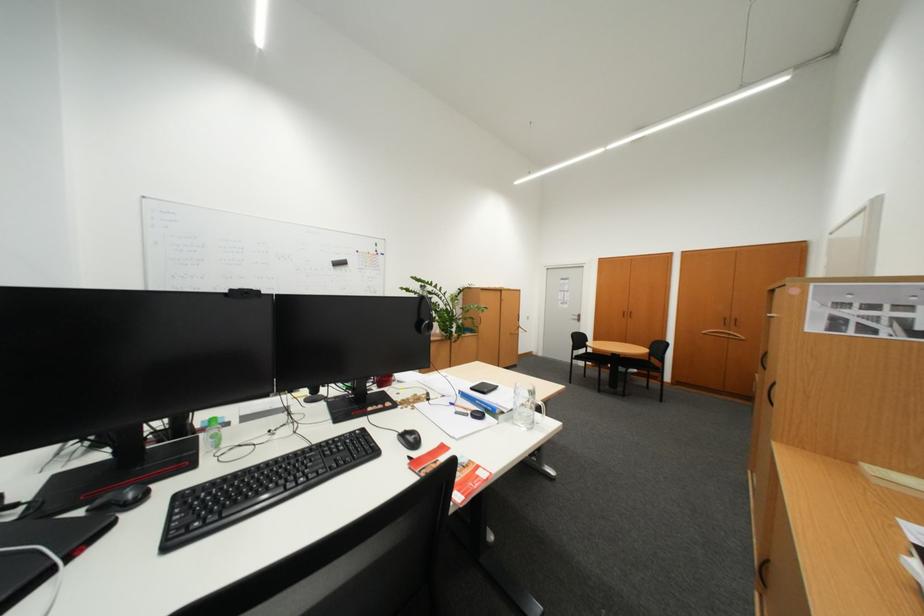
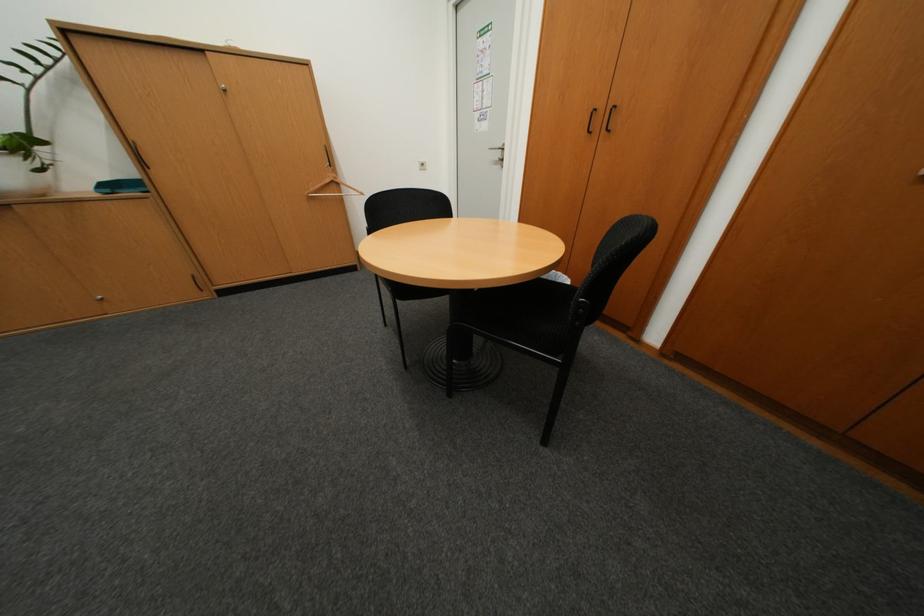
In a continuous first-person perspective shot, in which direction is the camera moving?

The movement direction of the cameraman is right, forward.